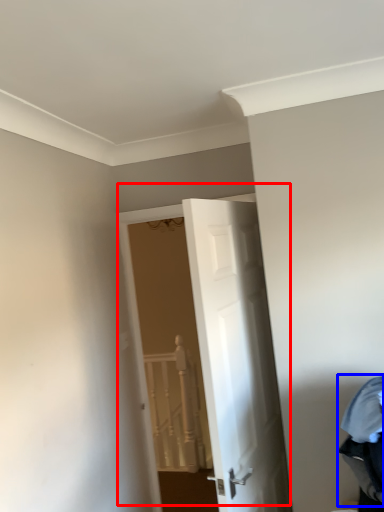
Question: Which object is closer to the camera taking this photo, door (highlighted by a red box) or laundry (highlighted by a blue box)?

Choices:
 (A) door
 (B) laundry

Answer: (B)